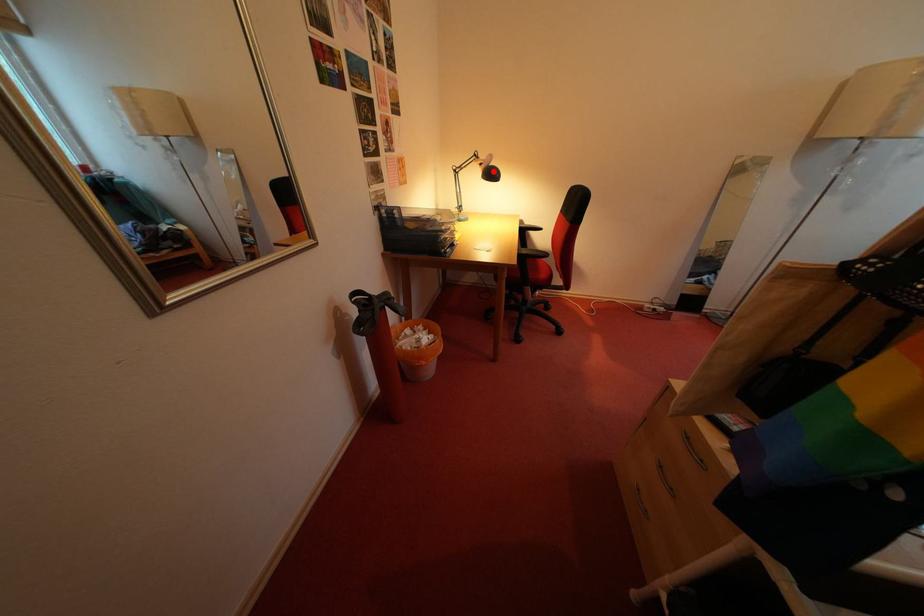
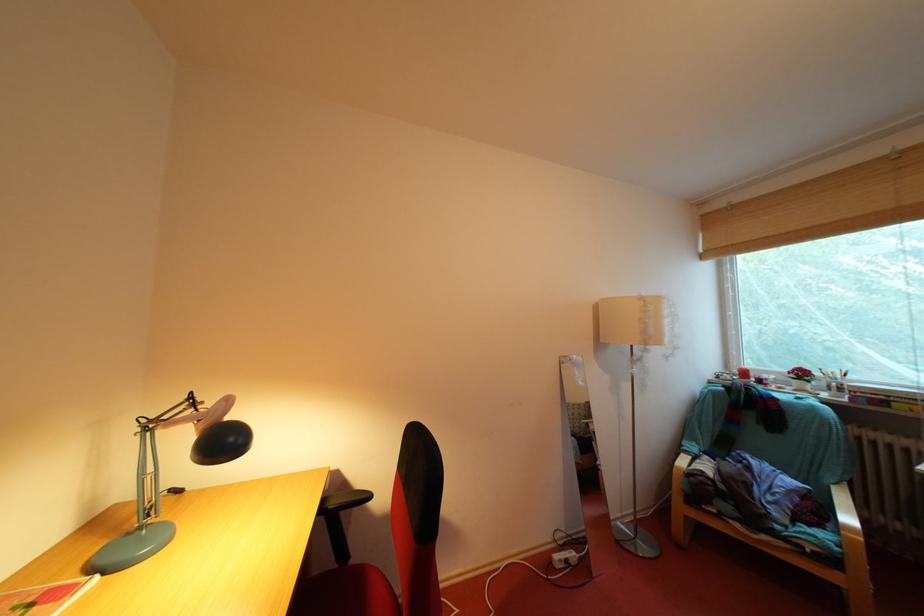
Locate, in the second image, the point that corresponds to the highlighted location in the first image.

(215, 429)